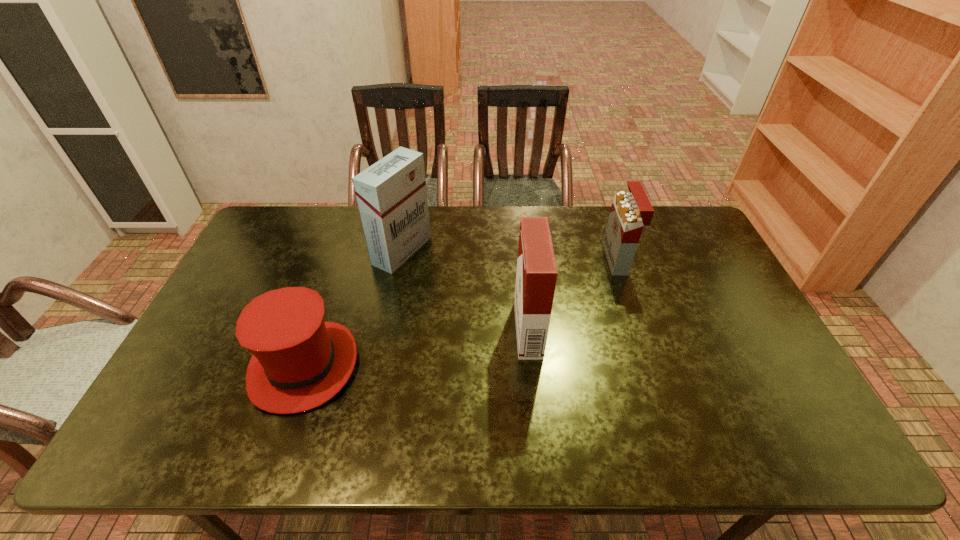
Where is `the leftmost cigarette case`? The height and width of the screenshot is (540, 960). the leftmost cigarette case is located at coordinates (391, 194).

Image resolution: width=960 pixels, height=540 pixels. I want to click on the nearest cigarette case, so click(536, 275).

Identify the location of the second object from right to left. Image resolution: width=960 pixels, height=540 pixels. (536, 275).

You are a GUI agent. You are given a task and a screenshot of the screen. Output one action in this format:
    pyautogui.click(x=<x>, y=<y>)
    Task: Click on the rightmost cigarette case
    This screenshot has height=540, width=960.
    Given the screenshot: What is the action you would take?
    pyautogui.click(x=630, y=212)

Where is `the third tallest object`? The height and width of the screenshot is (540, 960). the third tallest object is located at coordinates (630, 212).

Where is `hat`? hat is located at coordinates (299, 362).

Locate an element on the screen. The image size is (960, 540). vacant space positioned 0.130m on the left of the leftmost cigarette case is located at coordinates (336, 251).

Find the location of a particular element. The height and width of the screenshot is (540, 960). free location located on the front-facing side of the nearest cigarette case is located at coordinates (388, 329).

Locate an element on the screen. The width and height of the screenshot is (960, 540). free location located on the front-facing side of the nearest cigarette case is located at coordinates (373, 329).

The height and width of the screenshot is (540, 960). I want to click on vacant space located on the front-facing side of the nearest cigarette case, so click(x=494, y=329).